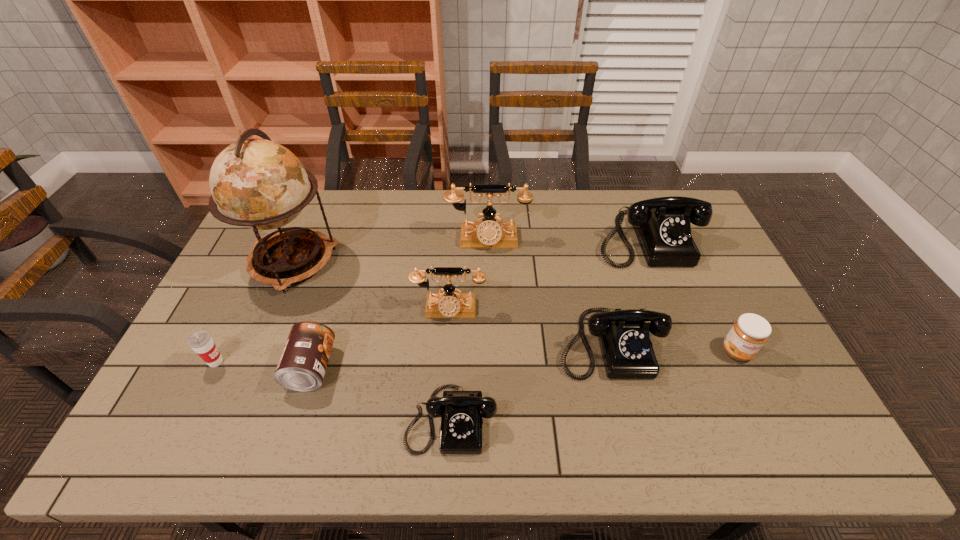
This screenshot has width=960, height=540. Find the location of `the tallest object`. the tallest object is located at coordinates (257, 183).

You are a GUI agent. You are given a task and a screenshot of the screen. Output one action in this format:
    pyautogui.click(x=<x>, y=<y>)
    Task: Click on the tallest telephone
    The image size is (960, 540).
    Given the screenshot: What is the action you would take?
    pyautogui.click(x=488, y=233)

At what (x,y) coordinates should I click in order to perform the action: click on the eighth shortest object. Please return your answer as a coordinate pair (x, y). This screenshot has width=960, height=540. Looking at the image, I should click on (488, 233).

Locate an element on the screen. the biggest black telephone is located at coordinates (662, 225).

Identify the location of the smaller beige telephone. The height and width of the screenshot is (540, 960). click(x=449, y=304).

Locate an element on the screen. Image resolution: width=960 pixels, height=540 pixels. the second biggest black telephone is located at coordinates (627, 352).

Identify the location of the second farthest black telephone. (627, 352).

This screenshot has height=540, width=960. In order to click on cup in this screenshot , I will do `click(201, 342)`.

I want to click on jam, so click(x=749, y=333).

Locate an element on the screen. This screenshot has width=960, height=540. can is located at coordinates (302, 366).